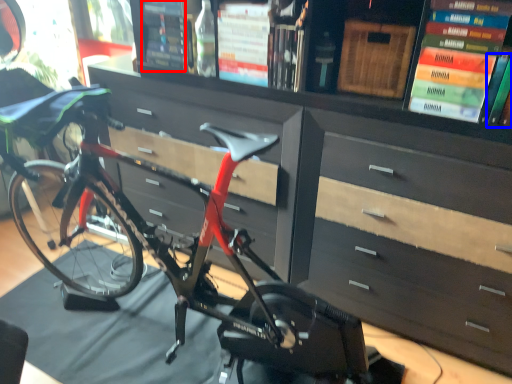
Question: Among these objects, which one is nearest to the camera, book (highlighted by a red box) or book (highlighted by a blue box)?

Choices:
 (A) book
 (B) book

Answer: (B)